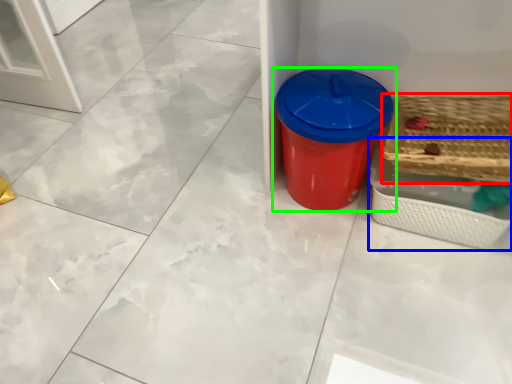
Question: Estimate the real-world distances between objects in this image. Which object is closer to basket (highlighted by a red box), basket (highlighted by a blue box) or waste container (highlighted by a green box)?

Choices:
 (A) basket
 (B) waste container

Answer: (A)